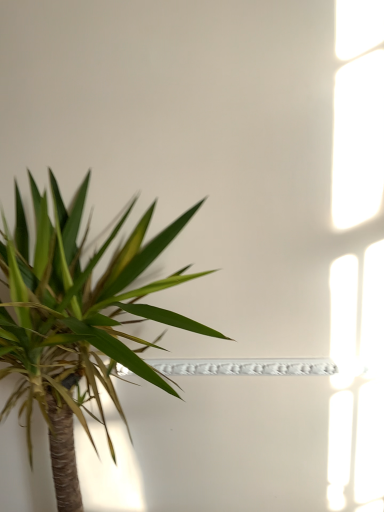
Identify the location of green leafy plant at left. (77, 322).

The width and height of the screenshot is (384, 512). What do you see at coordinates (77, 322) in the screenshot?
I see `green leafy plant at left` at bounding box center [77, 322].

The height and width of the screenshot is (512, 384). What are the coordinates of `green leafy plant at left` in the screenshot? It's located at (77, 322).